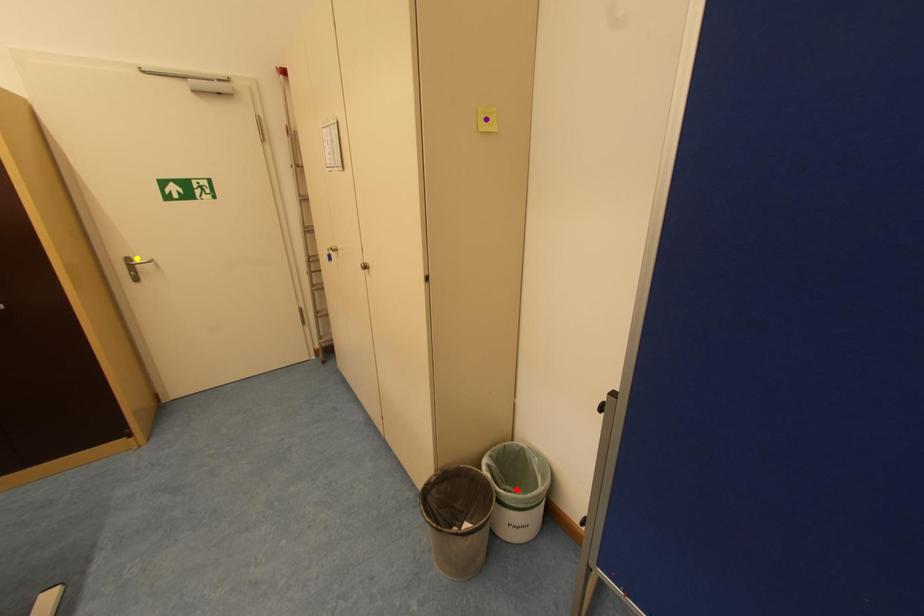
Order these from nearest to farthest:
purple point, yellow point, red point

purple point
red point
yellow point